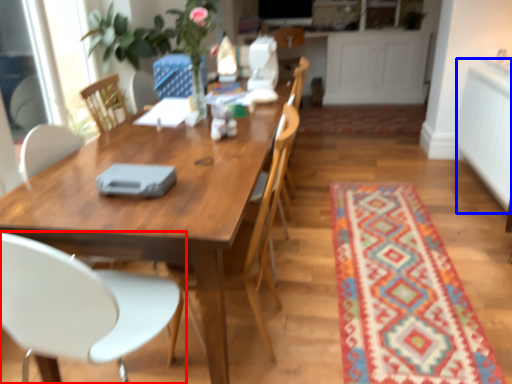
Question: Among these objects, which one is nearest to the camera, chair (highlighted by a red box) or counter top (highlighted by a blue box)?

Choices:
 (A) chair
 (B) counter top

Answer: (A)